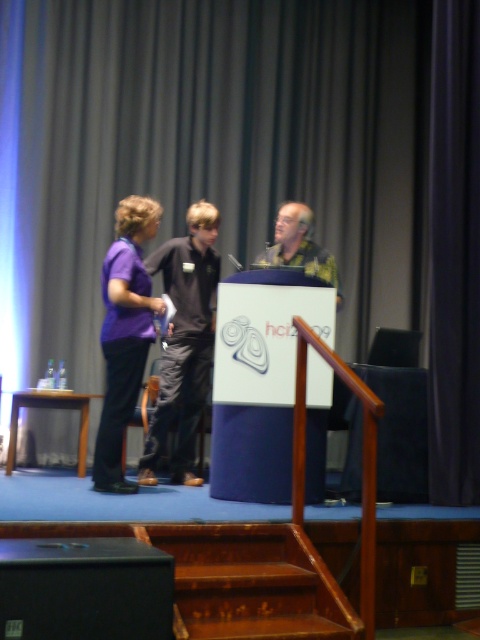
Question: Which point is closer to the camera taking this photo?

Choices:
 (A) (131, 488)
 (B) (276, 253)
 (C) (22, 541)

Answer: (C)

Question: Is purple fabric shirt at left positioned in front of purple matte shirt at left?

Choices:
 (A) no
 (B) yes

Answer: (A)

Question: Is purple matte shirt at left further to camera compared to yellow-green textured shirt at center?

Choices:
 (A) yes
 (B) no

Answer: (B)

Question: Does purple matte shirt at left have a larger size compared to yellow-green textured shirt at center?

Choices:
 (A) no
 (B) yes

Answer: (B)

Question: Which of the following is the farthest from the observer?

Choices:
 (A) black matte speaker at lower left
 (B) purple matte shirt at left
 (C) purple fabric shirt at left
 (D) yellow-green textured shirt at center

Answer: (C)

Question: Which point is farther to the camera?

Choices:
 (A) (3, 611)
 (B) (278, 252)
 (C) (109, 296)
 (D) (164, 422)

Answer: (B)